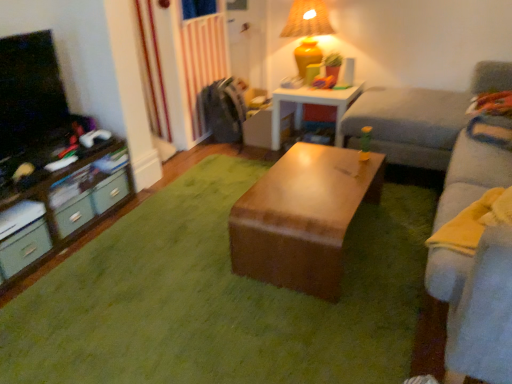
The width and height of the screenshot is (512, 384). Identify the location of free spot to the right of green plastic drawer at left, which ranks as the third drawer in front-to-back order. (144, 206).